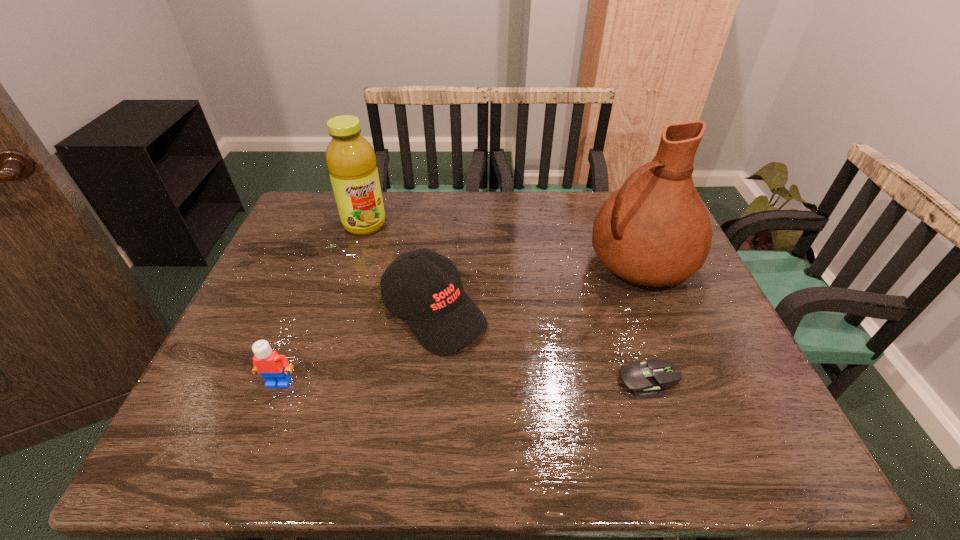
Identify the location of vacant area located 0.070m on the front-facing side of the third object from left to right. tap(491, 361).

Locate an element on the screen. The height and width of the screenshot is (540, 960). blank area located 0.210m on the front-facing side of the third object from left to right is located at coordinates point(536,400).

Where is `free point located 0.280m on the side of the tallest object with the handle`? free point located 0.280m on the side of the tallest object with the handle is located at coordinates (519, 326).

Image resolution: width=960 pixels, height=540 pixels. Identify the location of vacant space situated 0.130m on the side of the tallest object with the handle. (565, 302).

Identify the location of free space located on the side of the tallest object with the handle. (503, 334).

Find the location of `fruit juice at the far edge`. fruit juice at the far edge is located at coordinates (351, 162).

The width and height of the screenshot is (960, 540). Find the location of `pitcher at the far edge`. pitcher at the far edge is located at coordinates click(655, 230).

Image resolution: width=960 pixels, height=540 pixels. Find the location of `Lego that is at the near edge`. Lego that is at the near edge is located at coordinates (273, 367).

At what (x,y) coordinates should I click in order to perform the action: click on computer mouse that is at the near edge. Please return your answer as a coordinate pair (x, y). The height and width of the screenshot is (540, 960). Looking at the image, I should click on 647,380.

Where is `object that is positioned at the left edge`? The height and width of the screenshot is (540, 960). object that is positioned at the left edge is located at coordinates (273, 367).